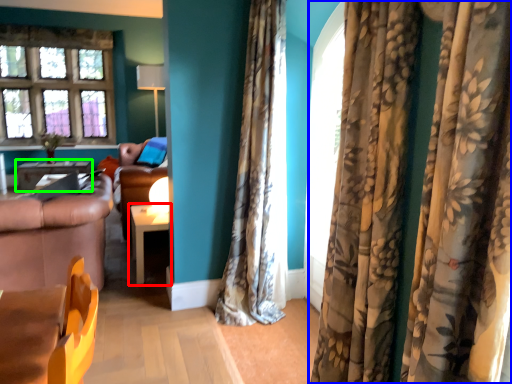
Question: Based on their relative distances, which object is farther from table (highlighted by a red box)? Choose from curtain (highlighted by a blue box) and table (highlighted by a green box).

Choices:
 (A) curtain
 (B) table

Answer: (B)